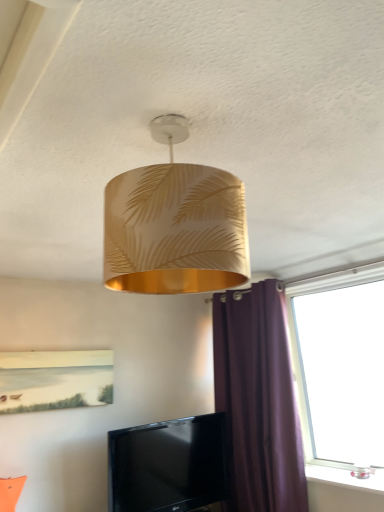
Question: From a real-world perspective, is transparent glass window at right positioned above or below black glossy tv at lower center?

Choices:
 (A) below
 (B) above

Answer: (B)

Question: In terms of size, does transparent glass window at right appear bigger or smaller than black glossy tv at lower center?

Choices:
 (A) big
 (B) small

Answer: (A)

Question: Based on their relative distances, which object is nearer to the gold leaf-patterned lampshade at upper center?

Choices:
 (A) purple fabric curtain at right
 (B) transparent glass window at right
 (C) black glossy tv at lower center

Answer: (B)

Question: Considering the real-world distances, which object is farthest from the purple fabric curtain at right?

Choices:
 (A) gold leaf-patterned lampshade at upper center
 (B) black glossy tv at lower center
 (C) transparent glass window at right

Answer: (A)